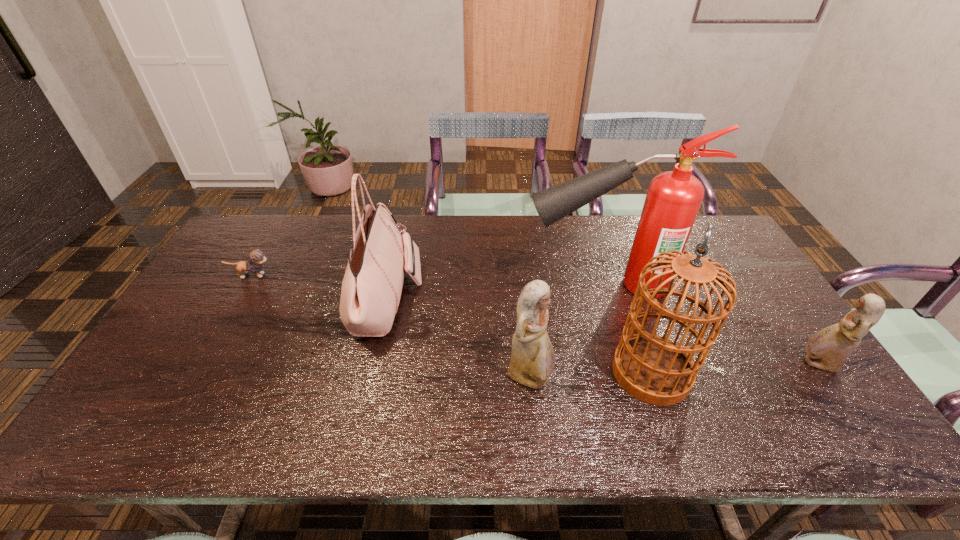
Locate an element on the screen. This screenshot has height=540, width=960. the taller figurine is located at coordinates (532, 362).

Locate an element on the screen. the left figurine is located at coordinates (532, 362).

Find the location of a particular element. The height and width of the screenshot is (540, 960). the right figurine is located at coordinates (828, 349).

Where is `the shorter figurine`? The image size is (960, 540). the shorter figurine is located at coordinates (828, 349).

The height and width of the screenshot is (540, 960). I want to click on handbag, so click(x=371, y=290).

At what (x,y) coordinates should I click in order to perform the action: click on kitten. Please return your answer as a coordinate pair (x, y). The width and height of the screenshot is (960, 540). Looking at the image, I should click on (257, 257).

Locate an element on the screen. Image resolution: width=960 pixels, height=540 pixels. the leftmost object is located at coordinates (257, 257).

Locate an element on the screen. This screenshot has width=960, height=540. fire extinguisher is located at coordinates (673, 199).

In order to click on birdcage in this screenshot , I will do `click(653, 369)`.

This screenshot has height=540, width=960. I want to click on vacant space situated on the front-facing side of the taller figurine, so click(x=665, y=379).